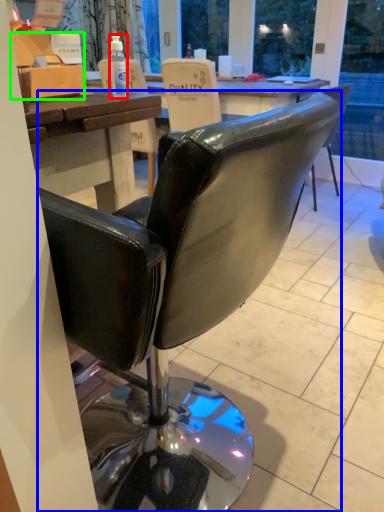
Question: Which object is positioned closest to bottle (highlighted by a red box)? Select from chair (highlighted by a blue box) and box (highlighted by a green box).

Choices:
 (A) chair
 (B) box

Answer: (B)